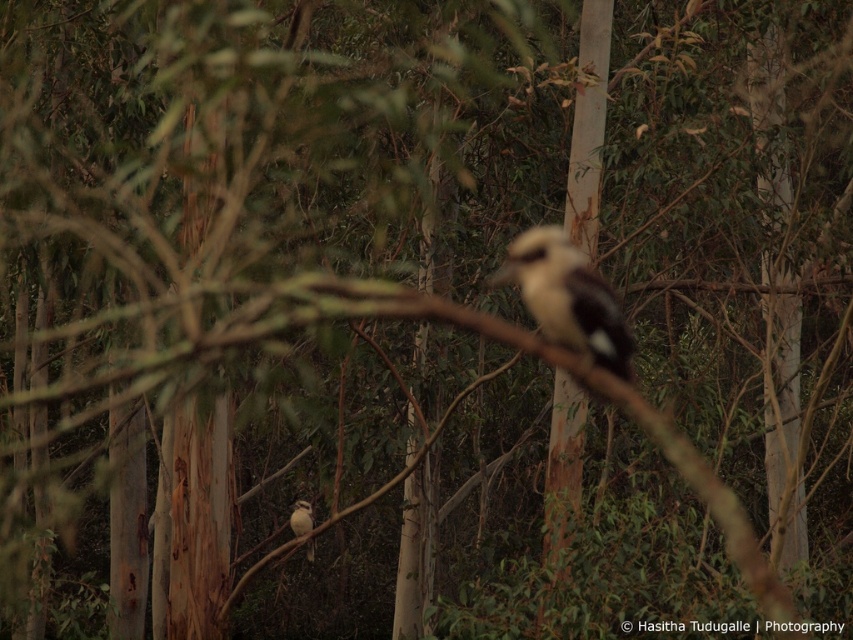
Question: Which point is farther to the camera?

Choices:
 (A) (555, 264)
 (B) (303, 506)

Answer: (B)

Question: Which point is farther to the camera?

Choices:
 (A) white matte bird at center
 (B) white-brown speckled bird at center

Answer: (A)

Question: From the image, what is the correct spatial relationship of white-brown speckled bird at center in relation to white matte bird at center?

Choices:
 (A) below
 (B) above

Answer: (B)

Question: From the image, what is the correct spatial relationship of white-brown speckled bird at center in relation to white matte bird at center?

Choices:
 (A) left
 (B) right

Answer: (B)

Question: Is white-brown speckled bird at center above white matte bird at center?

Choices:
 (A) yes
 (B) no

Answer: (A)